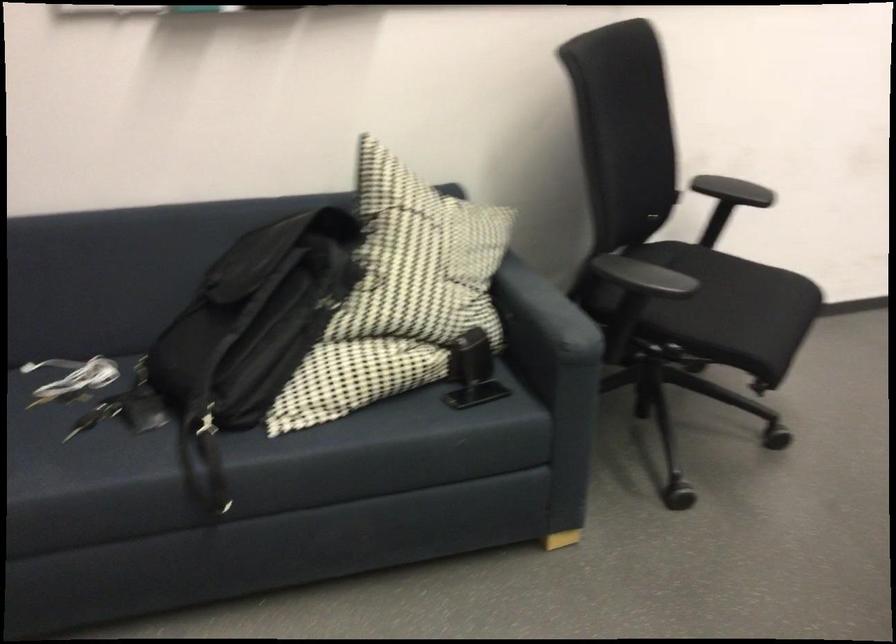
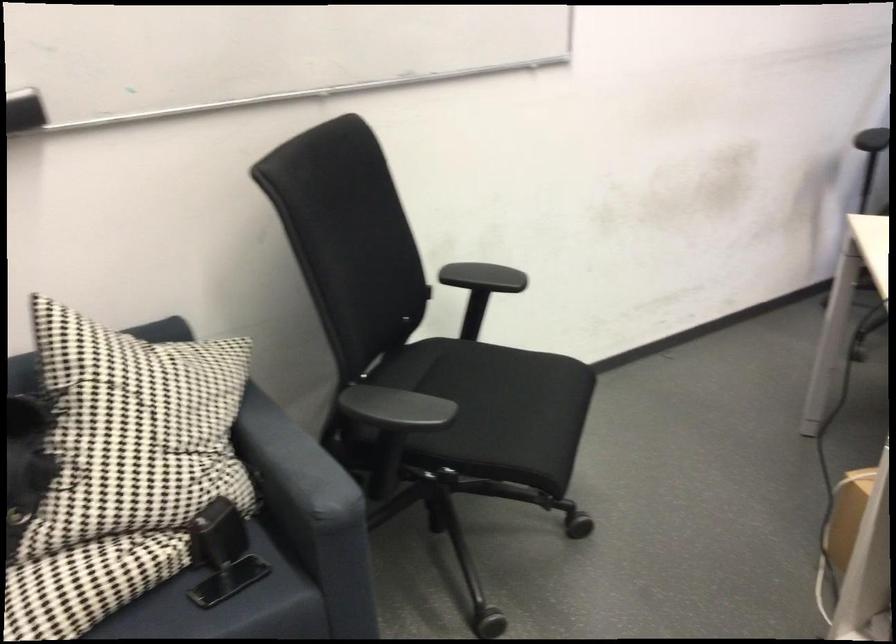
Where in the second image is the point corresponding to [470,355] from the first image?

(218, 534)